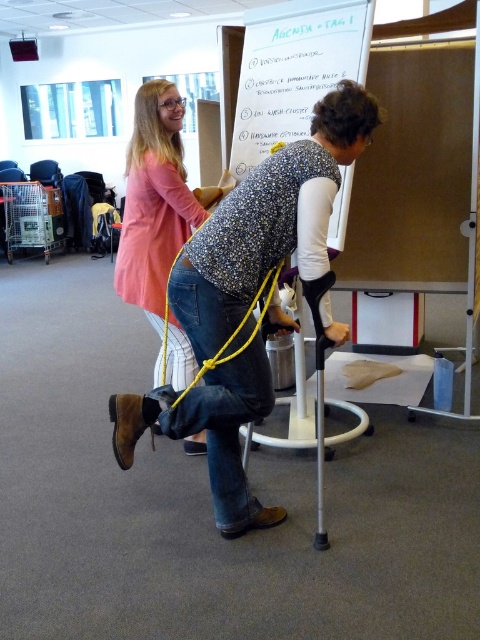
Does point (139, 152) lie in front of point (233, 352)?

No, (139, 152) is behind (233, 352).

Between point (157, 168) and point (277, 269), which one is positioned behind?

Point (157, 168)

I want to click on matte pink sweater at upper left, so click(x=156, y=204).

Which of these two, whiteboard at upper center or matte pink sweater at upper left, stands taller?

Standing taller between the two is matte pink sweater at upper left.

Who is shorter, whiteboard at upper center or matte pink sweater at upper left?

whiteboard at upper center

I want to click on whiteboard at upper center, so click(x=294, y=68).

The width and height of the screenshot is (480, 640). What are the coordinates of `whiteboard at upper center` in the screenshot? It's located at (294, 68).

Can you confirm if denim jeans at center is wider than yellow string at center?

Yes.

Locate an element on the screen. This screenshot has width=480, height=640. denim jeans at center is located at coordinates (248, 298).